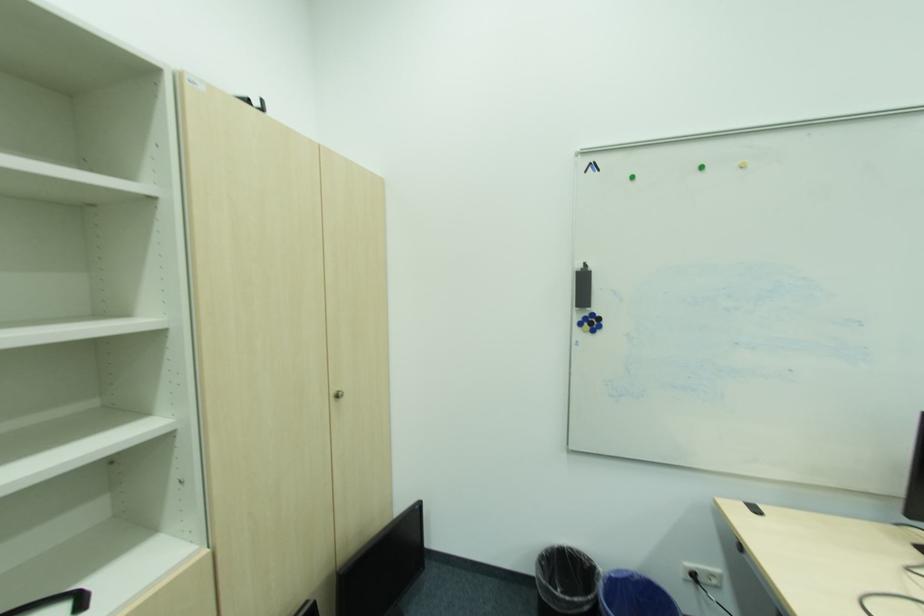
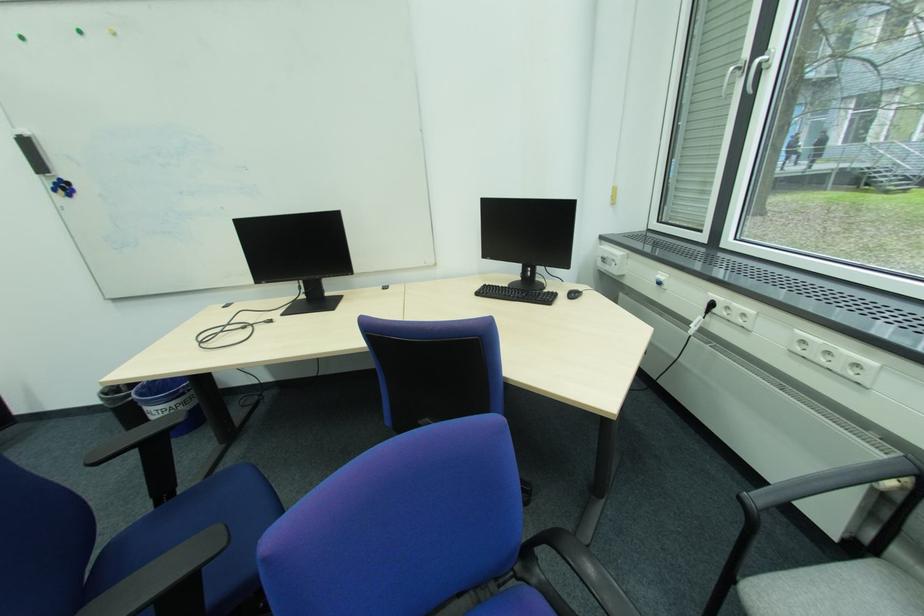
Find the pixel in the second image that matches point (591, 318) in the first image.

(62, 185)